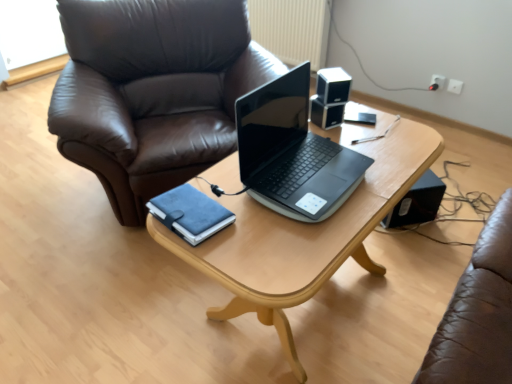
The width and height of the screenshot is (512, 384). Identify the location of free location to the right of sleek black laptop at center. pyautogui.click(x=387, y=166).